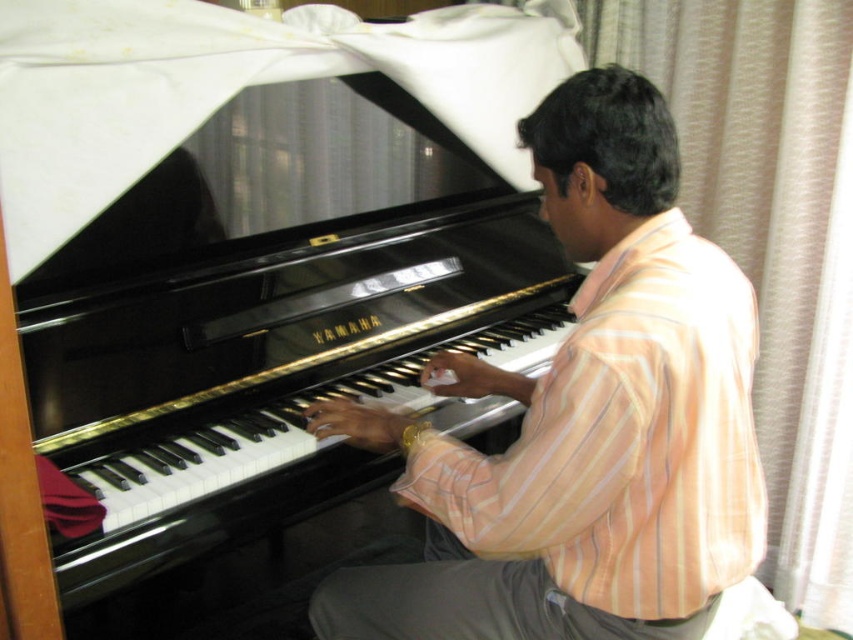
You are a photographer setting up for a portrait. You need to ensure that the striped cotton shirt at center is visible above the black polished piano at center. Given their current heights, will you need to adjust the camera angle upwards or downwards?

The striped cotton shirt at center is shorter than the black polished piano at center, so to make the shirt visible above the piano, you need to adjust the camera angle upwards.

You are standing in front of the piano and want to place a small music stand in a position that won not block the view of the striped cotton shirt at center. Where should you place the music stand?

Place the music stand away from the area around point (584,420) to avoid blocking the view of the striped cotton shirt at center.

You are a photographer setting up for a photoshoot at the location shown. You need to place a light source to the left of the striped cotton shirt at center and to the right of the black polished piano at center. Is this possible given their current positions?

The striped cotton shirt at center is positioned on the right side of black polished piano at center, so placing a light source to the left of the striped cotton shirt at center and to the right of the black polished piano at center is possible since the shirt is to the right of the piano.